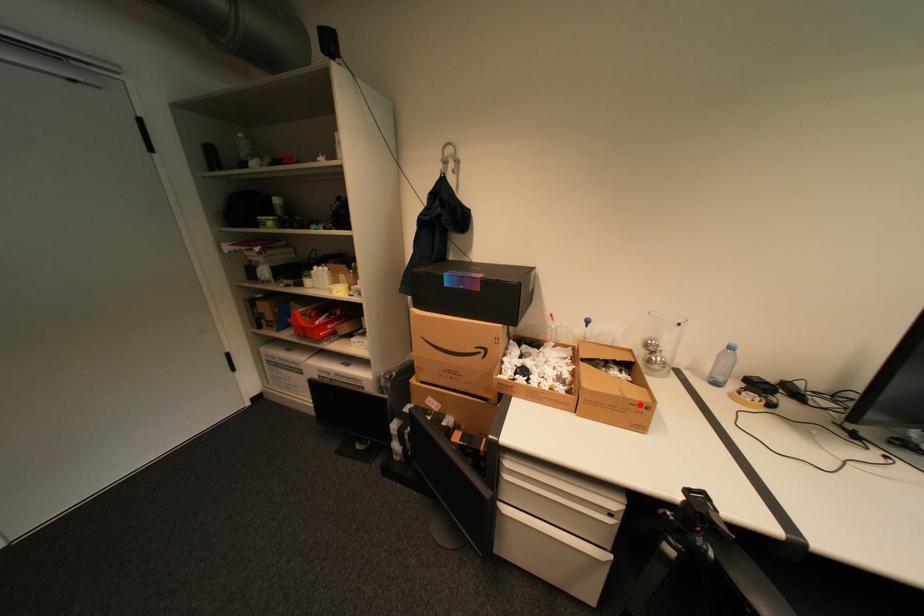
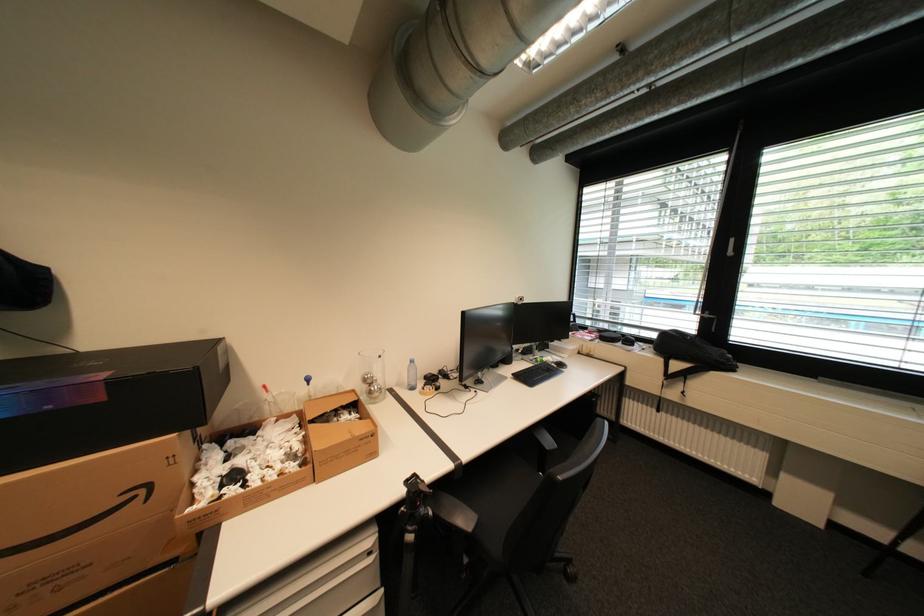
The point at the highlighted location is marked in the first image. Where is the corresponding point in the second image?

(370, 440)